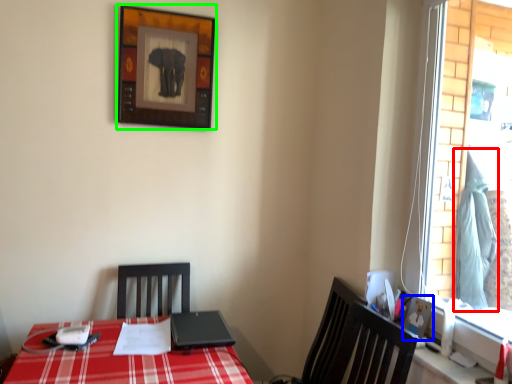
Question: Based on their relative distances, which object is farther from curtain (highlighted by a red box)? Choose from picture frame (highlighted by a blue box) and picture frame (highlighted by a green box).

Choices:
 (A) picture frame
 (B) picture frame

Answer: (B)